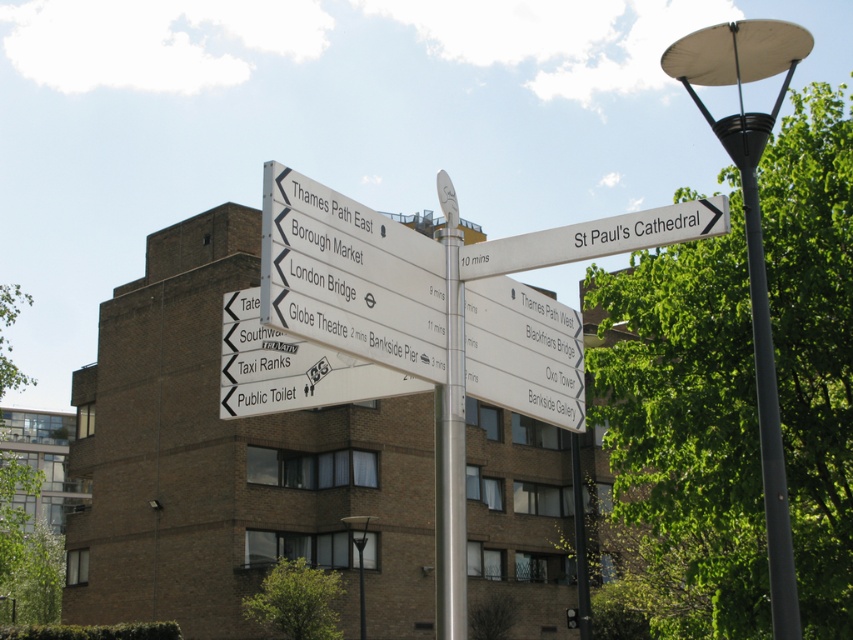
You are a pedestrian standing on the sidewalk and see the black metal lamp post at upper right and the white plastic street sign at upper right. Which one is taller?

The black metal lamp post at upper right is taller than the white plastic street sign at upper right.

You are a tourist holding a map and standing in front of the silver metallic pole at center. You see the white plastic street sign at upper right. According to the signs, which direction should you walk to reach the Thames Path East?

The Thames Path East is indicated by the arrow on the white plastic street sign at upper right pointing to the right, so you should walk in the direction the arrow points, which is to the right of the sign.

You are standing in front of the street signpost and want to locate the black metal lamp post at upper right. According to the coordinates provided, where exactly is it positioned?

The black metal lamp post at upper right is positioned at point (753, 246).